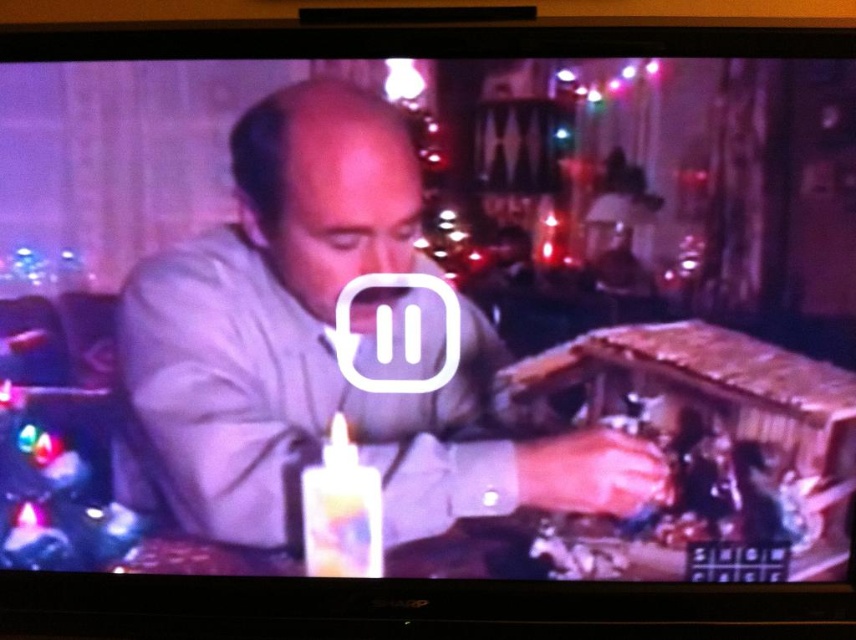
Can you confirm if matte gray shirt at center is bigger than white glossy birthday candle at lower center?

Yes, matte gray shirt at center is bigger than white glossy birthday candle at lower center.

Does matte gray shirt at center have a lesser height compared to white glossy birthday candle at lower center?

Incorrect, matte gray shirt at center's height does not fall short of white glossy birthday candle at lower center's.

Identify the location of matte gray shirt at center. This screenshot has height=640, width=856. (322, 349).